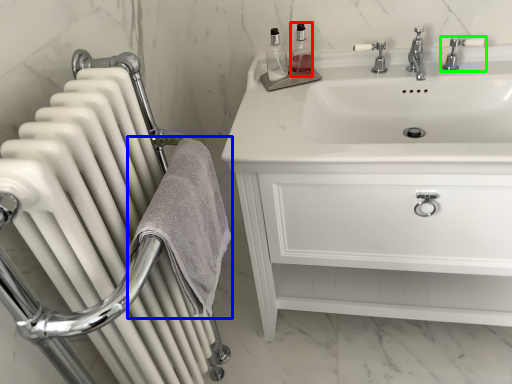
Question: Which is nearer to the soap dispenser (highlighted by a red box)? bath towel (highlighted by a blue box) or tap (highlighted by a green box).

Choices:
 (A) bath towel
 (B) tap

Answer: (B)